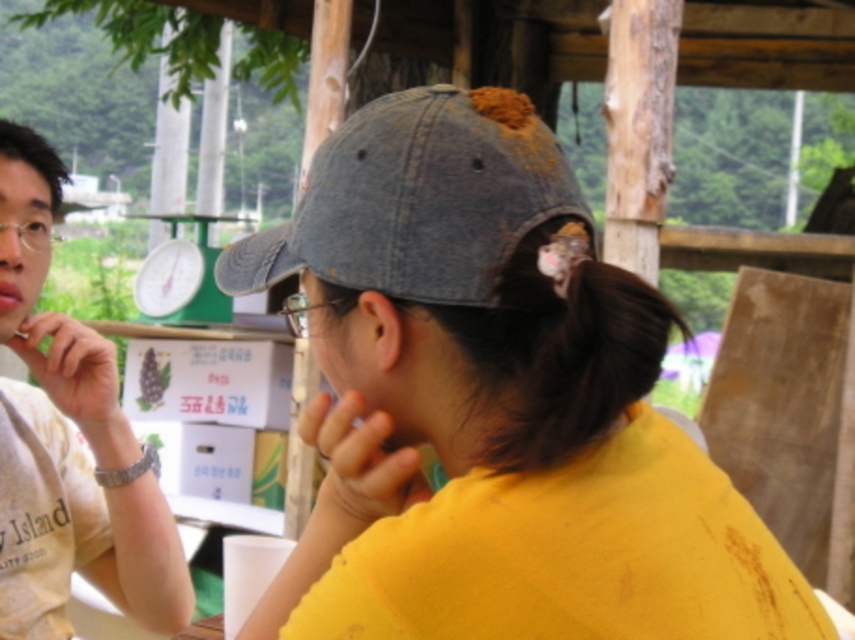
Is point (305, 560) closer to camera compared to point (346, 275)?

No, it is behind (346, 275).

Who is more distant from viewer, (617, 611) or (346, 132)?

Point (346, 132)

This screenshot has width=855, height=640. I want to click on denim cap at center, so click(493, 403).

Between denim cap at center and pink matte lips at center, which one has less height?

With less height is pink matte lips at center.

Locate an element on the screen. The image size is (855, 640). denim cap at center is located at coordinates (493, 403).

Between point (372, 388) and point (4, 300), which one is positioned behind?

The point (4, 300) is behind.

Locate an element on the screen. The image size is (855, 640). denim cap at center is located at coordinates (493, 403).

The width and height of the screenshot is (855, 640). What do you see at coordinates (417, 198) in the screenshot?
I see `denim baseball cap at center` at bounding box center [417, 198].

Which is behind, point (443, 120) or point (116, 566)?

Point (116, 566)

Between point (453, 292) and point (65, 358), which one is positioned behind?

The point (65, 358) is more distant.

Locate an element on the screen. denim baseball cap at center is located at coordinates (417, 198).